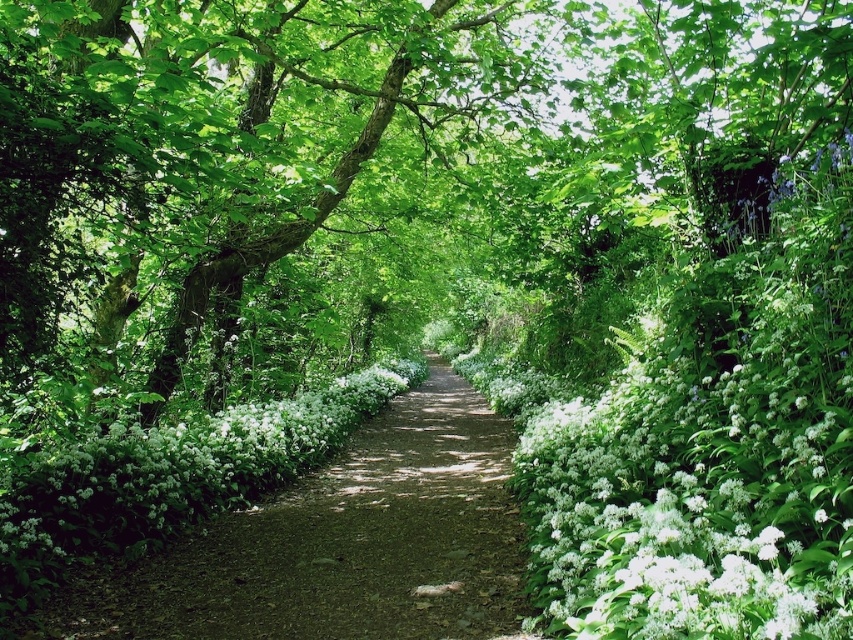
Question: Among these points, which one is nearest to the camera?

Choices:
 (A) (267, 476)
 (B) (83, 38)

Answer: (B)

Question: Is green leafy tree at center above white matte flowers at center?

Choices:
 (A) yes
 (B) no

Answer: (A)

Question: Which of the following is the farthest from the observer?

Choices:
 (A) (412, 74)
 (B) (231, 492)

Answer: (A)

Question: Can you confirm if green leafy tree at center is thinner than white matte flowers at center?

Choices:
 (A) yes
 (B) no

Answer: (A)

Question: Does green leafy tree at center have a lesser width compared to white matte flowers at center?

Choices:
 (A) no
 (B) yes

Answer: (B)

Question: Among these objects, which one is nearest to the camera?

Choices:
 (A) white matte flowers at center
 (B) green leafy tree at center

Answer: (A)